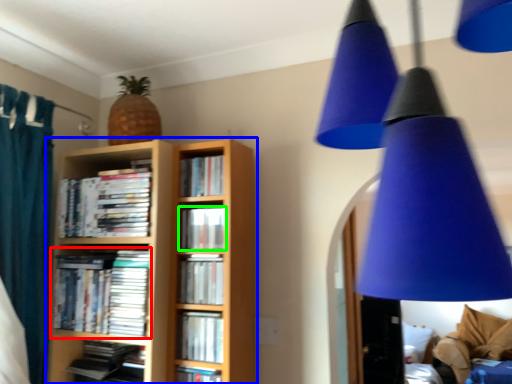
Question: Estimate the real-world distances between objects in this image. Which object is closer to book (highlighted by a red box), bookcase (highlighted by a blue box) or book (highlighted by a green box)?

Choices:
 (A) bookcase
 (B) book

Answer: (A)